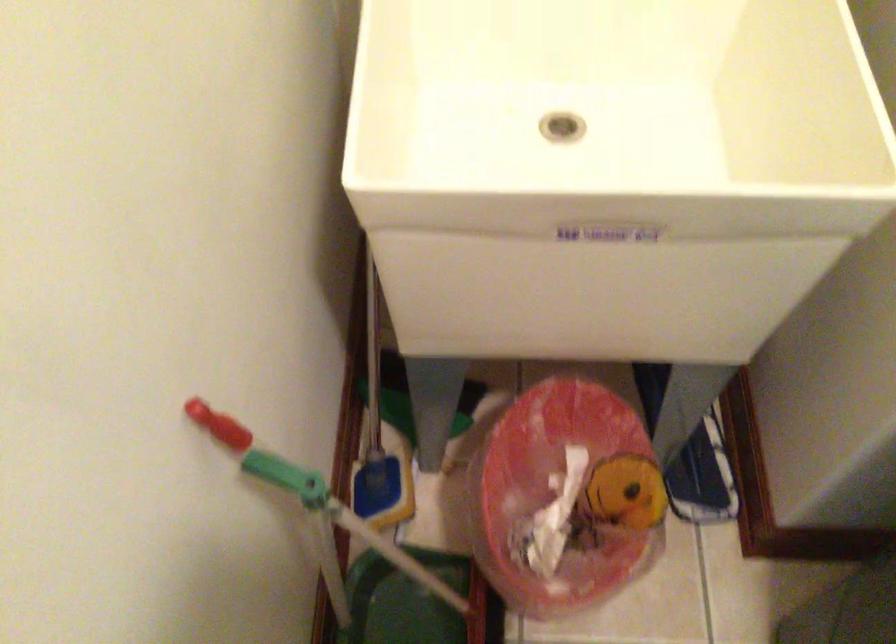
The height and width of the screenshot is (644, 896). I want to click on red and green handle, so click(220, 426).